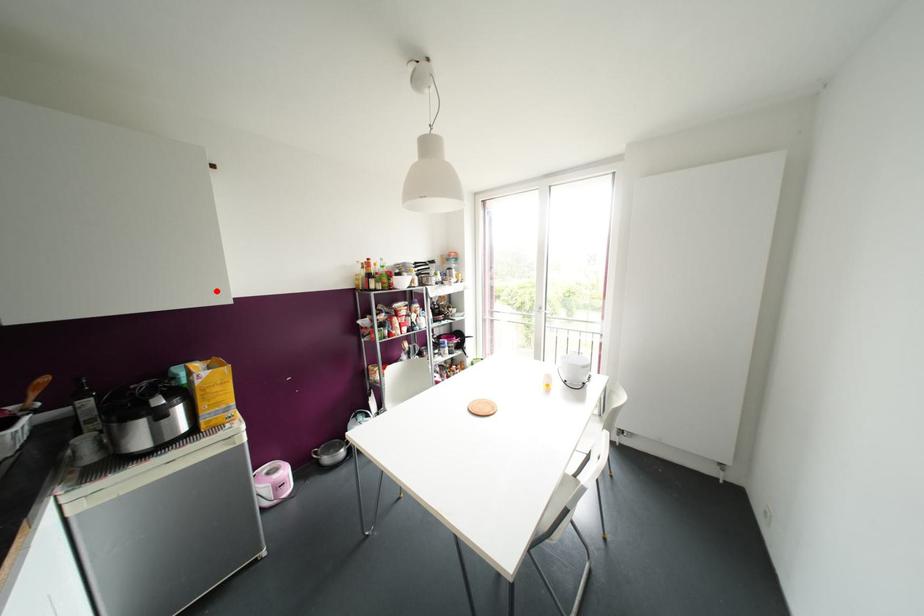
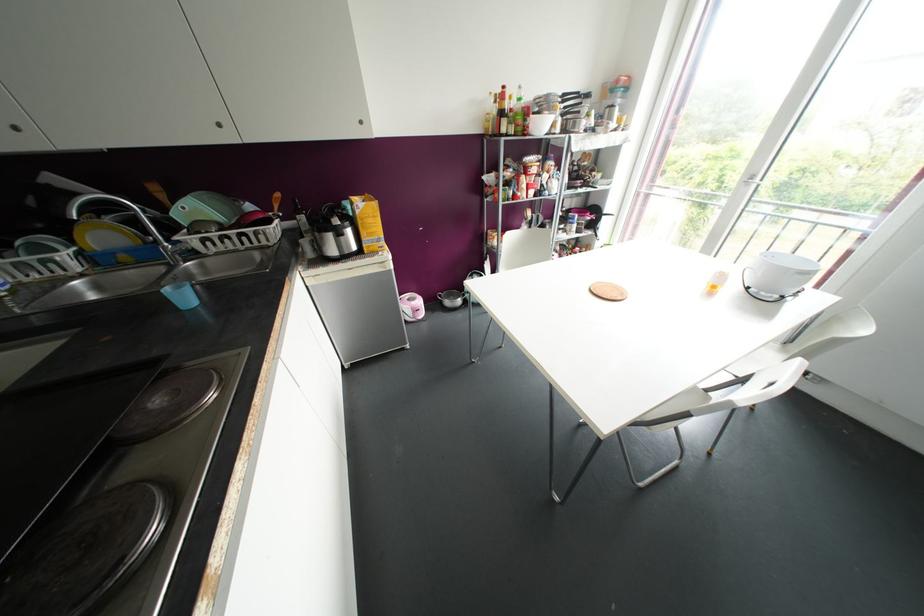
Where in the second image is the point corresponding to the highlighted location from the first image?

(360, 122)